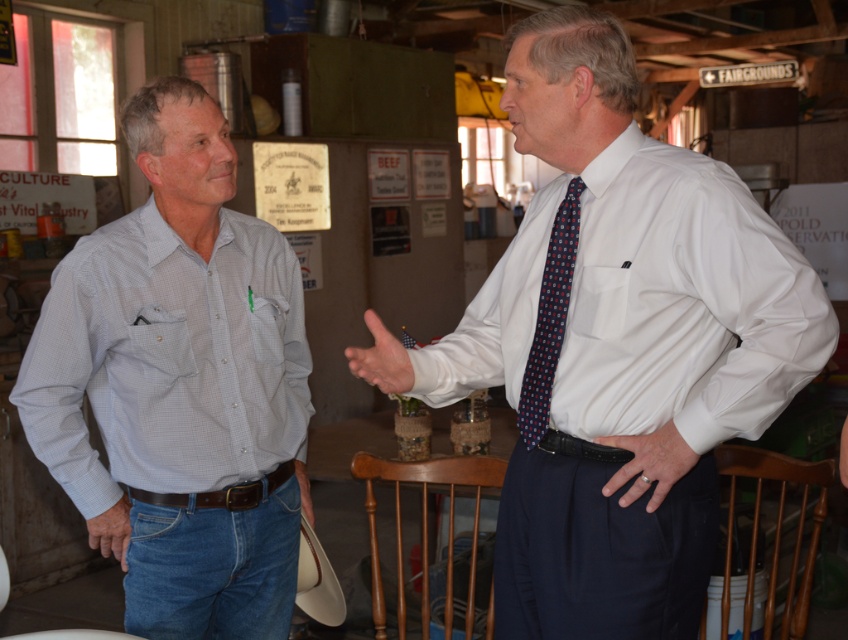
You are a fashion designer observing the scene. You need to decide which item to recommend for a client who prefers smaller accessories. Which one between the white leather hand at center and the leather glove at lower left would you suggest?

The white leather hand at center is smaller than the leather glove at lower left, so it would be the better recommendation for a client preferring smaller accessories.

You are standing in front of the two men in the image. There are two points marked in the scene. One is at coordinate point (544,529) and the other is at point (674,456). Which point is closer to you?

Point (544,529) is closer to you because it is further to the camera than point (674,456).

You are a photographer setting up a shoot in this rustic indoor setting. You need to position a spotlight so that it illuminates the white smooth shirt at right without casting a shadow from the white leather hand at center. Is this possible given their positions?

The white smooth shirt at right is above the white leather hand at center, so positioning the spotlight directly above the shirt would illuminate it while avoiding casting a shadow from the hand below.